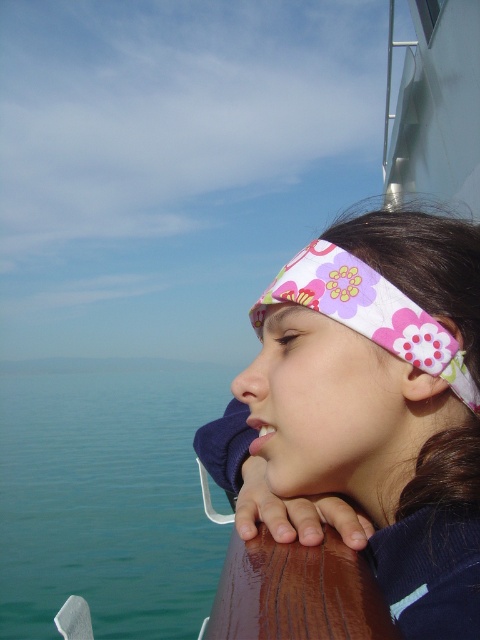
Does blue water at lower left appear on the right side of floral fabric headband at center?

No, blue water at lower left is not to the right of floral fabric headband at center.

Who is shorter, blue water at lower left or floral fabric headband at center?

floral fabric headband at center

Locate an element on the screen. The image size is (480, 640). blue water at lower left is located at coordinates (107, 497).

This screenshot has height=640, width=480. Identify the location of blue water at lower left. (107, 497).